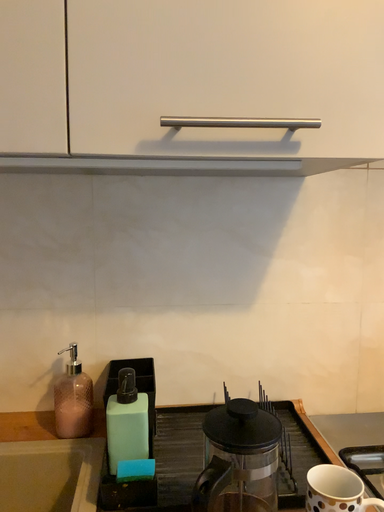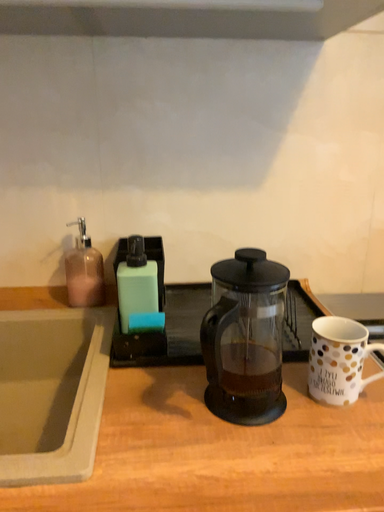
Question: How did the camera likely rotate when shooting the video?

Choices:
 (A) rotated downward
 (B) rotated upward

Answer: (A)